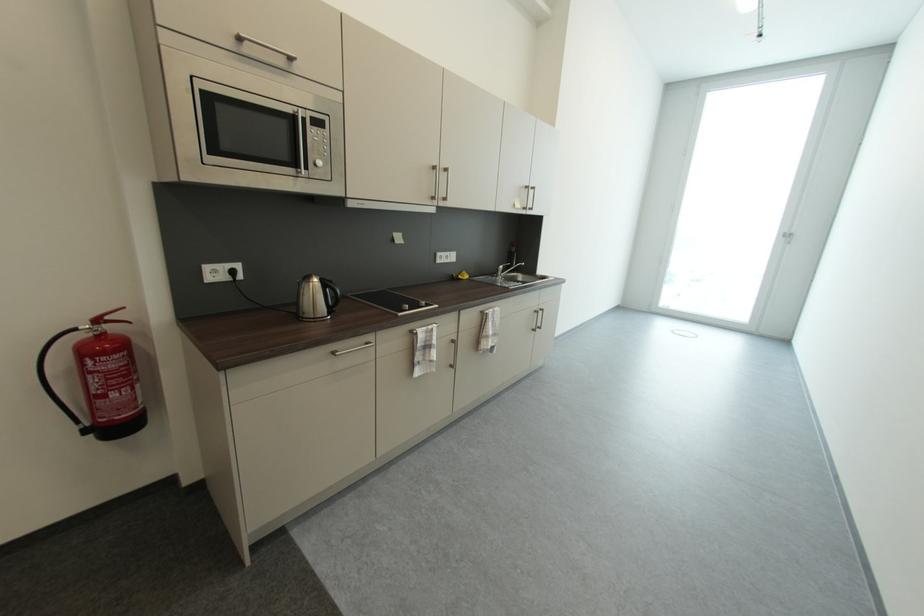
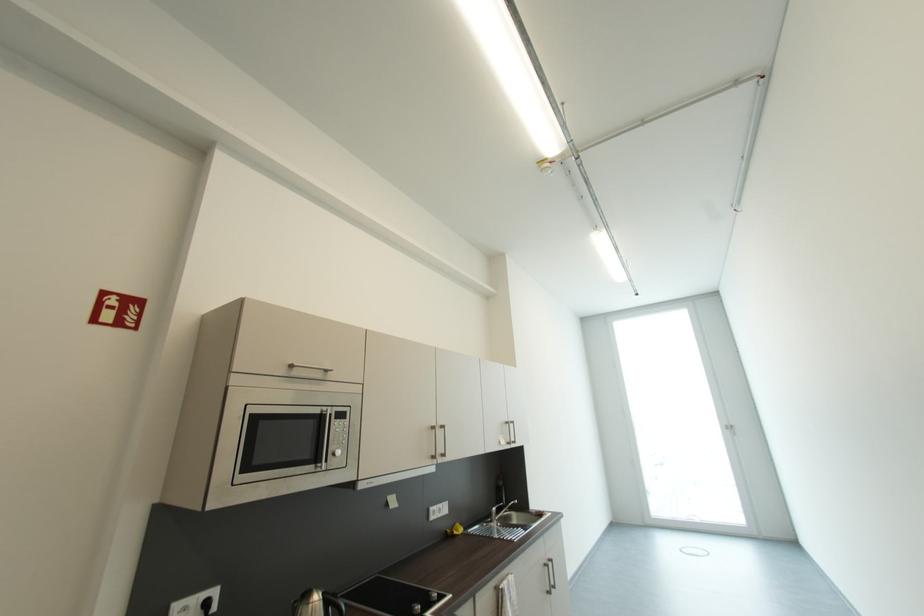
Locate, in the second image, the point that corresponds to (239,273) in the first image.

(213, 605)